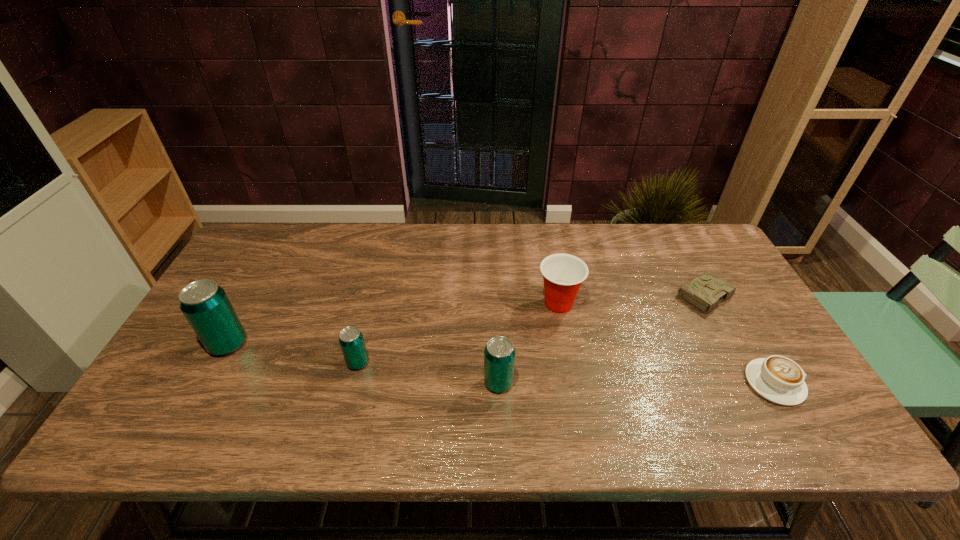
Find the location of a particular element. the leftmost object is located at coordinates (206, 306).

Find the location of `the leftmost beer can`. the leftmost beer can is located at coordinates (206, 306).

Locate an element on the screen. The height and width of the screenshot is (540, 960). the second object from left to right is located at coordinates (351, 340).

Find the location of a particular element. the shortest beer can is located at coordinates (351, 340).

This screenshot has width=960, height=540. What are the coordinates of `the second tallest beer can` in the screenshot? It's located at (499, 354).

Find the location of a particular element. the rightmost beer can is located at coordinates (499, 354).

Image resolution: width=960 pixels, height=540 pixels. Identify the location of diary. (705, 291).

At what (x,y) coordinates should I click in order to perform the action: click on cup. Please return your answer as a coordinate pair (x, y). Looking at the image, I should click on (563, 274).

Where is `the second shortest object`? the second shortest object is located at coordinates (778, 379).

Identify the location of free space located 0.200m on the right of the leftmost object. The height and width of the screenshot is (540, 960). (323, 344).